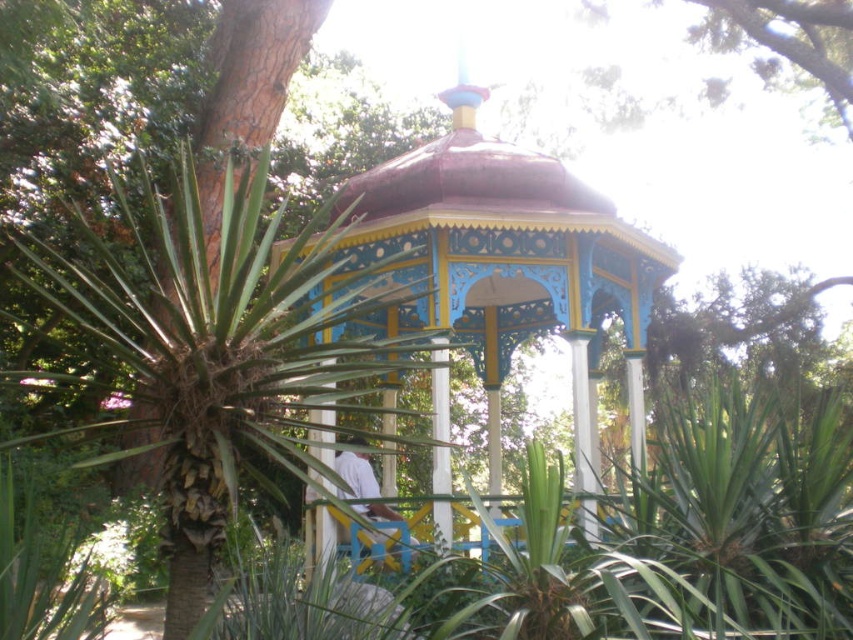
Does green leafy palm tree at center have a lesser width compared to painted wood gazebo at center?

Indeed, green leafy palm tree at center has a lesser width compared to painted wood gazebo at center.

Does green leafy palm tree at center appear on the right side of painted wood gazebo at center?

No, green leafy palm tree at center is not to the right of painted wood gazebo at center.

Who is more distant from viewer, [274,285] or [512,323]?

Positioned behind is point [512,323].

Locate an element on the screen. green leafy palm tree at center is located at coordinates (215, 349).